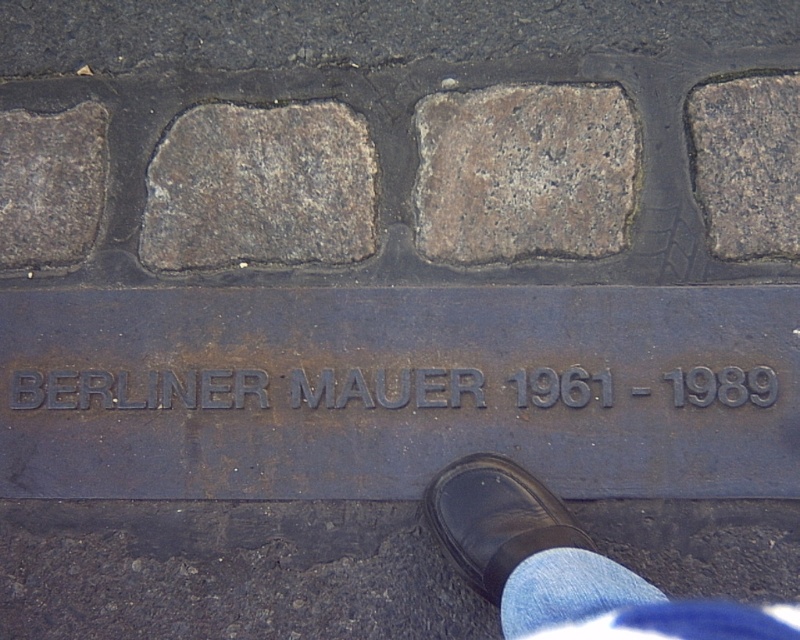
You are standing on the cobblestone pavement and see the metal plaque commemorating the Berlin Wall. There is a gray stone brick at center marked by point [260,188]. What is the color of the stone brick at the specified point?

The gray stone brick at center marked by point [260,188] is gray in color.

You are standing on the cobblestone pavement near the Berlin Wall plaque. You notice two points marked on the ground at coordinates point (418,212) and point (450,550). If you are facing north, which point is closer to you?

Point (418,212) is behind point (450,550), so when facing north, point (450,550) is closer to you.

You are a construction worker inspecting the cobblestone pavement. You notice the gray stone brick at upper right and the dark gray stone at left. Which one is thinner?

The gray stone brick at upper right is thinner than the dark gray stone at left.